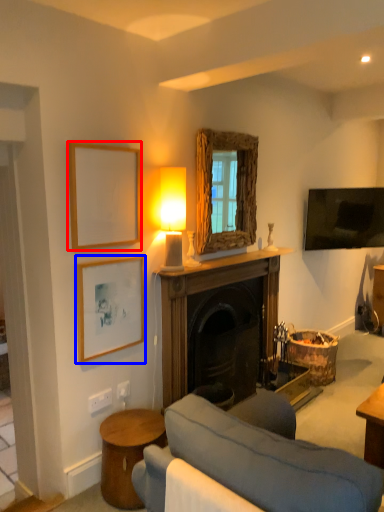
Question: Among these objects, which one is farthest to the camera, picture frame (highlighted by a red box) or picture frame (highlighted by a blue box)?

Choices:
 (A) picture frame
 (B) picture frame

Answer: (B)